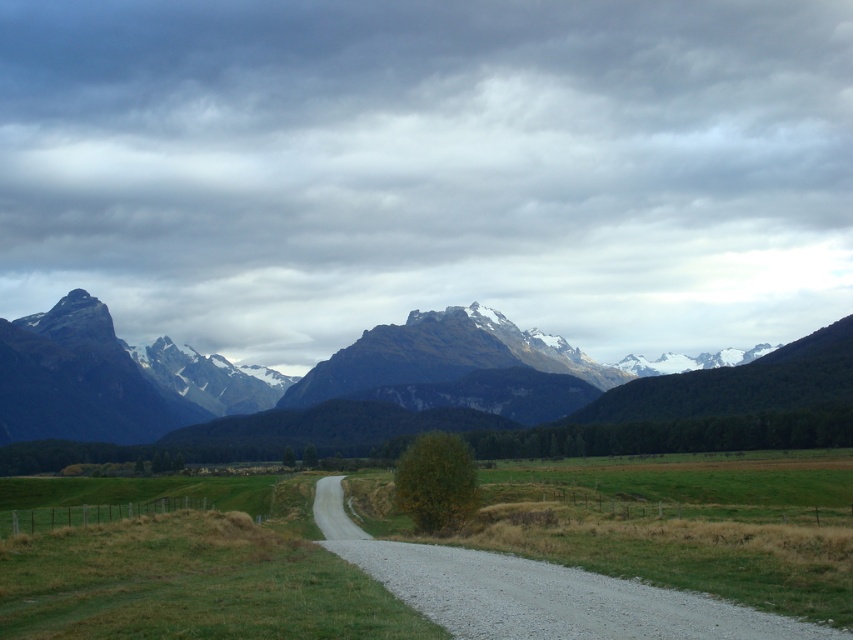
You are standing at the origin point of the image coordinate system. You want to walk to the gray gravel road at center. In which direction should you move relative to your current position?

Since the gray gravel road at center is located at coordinate point [553,598], you should move towards the right and upward from your current position at the origin to reach it.

You are standing at the point marked by the coordinates point (553, 598). Looking around, you see the gray gravel road at center. Which direction should you walk to stay on the gray gravel road at center as it curves gently to the left?

To stay on the gray gravel road at center as it curves gently to the left, you should walk in the direction the road is curving, which is to the left. This ensures you remain on the path as it bends.